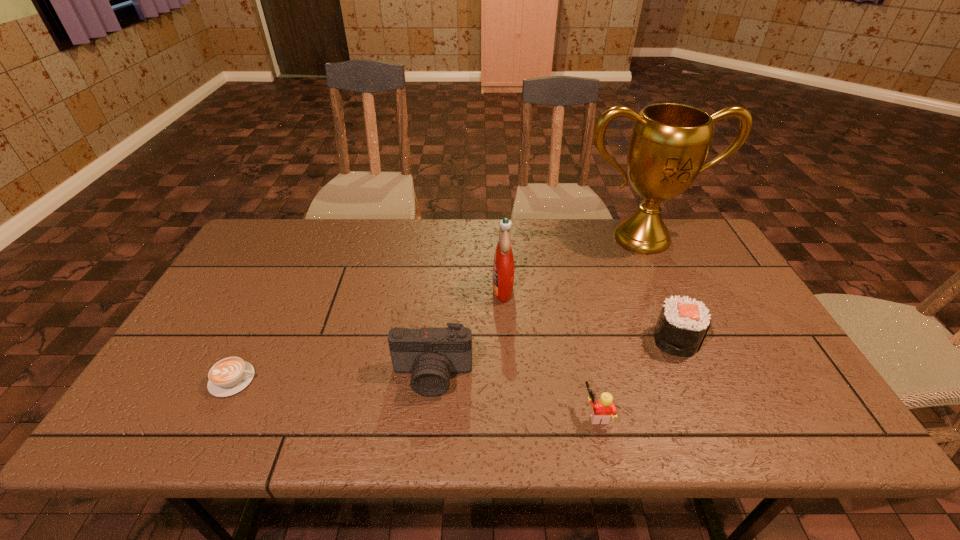
This screenshot has height=540, width=960. In order to click on vacant space in between the shortest object and the farthest object in this screenshot , I will do `click(438, 309)`.

Find the location of a particular element. Image resolution: width=960 pixels, height=540 pixels. vacant space that's between the second object from left to right and the sushi is located at coordinates (554, 357).

You are a GUI agent. You are given a task and a screenshot of the screen. Output one action in this format:
    pyautogui.click(x=<x>, y=<y>)
    Task: Click on the vacant space that's between the cappuccino and the tallest object
    The height and width of the screenshot is (540, 960).
    Given the screenshot: What is the action you would take?
    pyautogui.click(x=438, y=309)

Identify the location of vacant area that lies between the leftmost object and the detergent. This screenshot has height=540, width=960. (368, 334).

The image size is (960, 540). Find the location of `unoccupied position between the trophy cup and the fifth shortest object`. unoccupied position between the trophy cup and the fifth shortest object is located at coordinates (572, 263).

Where is `vacant point located between the second farthest object and the nearest object`? This screenshot has width=960, height=540. vacant point located between the second farthest object and the nearest object is located at coordinates (550, 351).

At what (x,y) coordinates should I click in order to perform the action: click on free point between the third object from left to right and the farthest object. Please return your answer as a coordinate pair (x, y). Looking at the image, I should click on (572, 263).

Locate an element on the screen. Image resolution: width=960 pixels, height=540 pixels. object that can be found as the second closest to the second farthest object is located at coordinates (669, 144).

Locate which object is the second closest to the farthest object. Please provide its 2D coordinates. Your answer should be formatted as a tuple, i.e. [(x, y)], where the tuple contains the x and y coordinates of a point satisfying the conditions above.

[(682, 325)]

This screenshot has height=540, width=960. I want to click on vacant area in the image that satisfies the following two spatial constraints: 1. on the surface of the trophy cup with symbols; 2. on the front surface of the fourth object from right to left, so click(x=665, y=288).